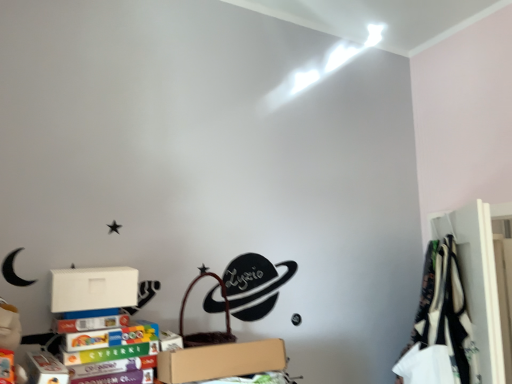
What do you see at coordinates (221, 361) in the screenshot? Image resolution: width=512 pixels, height=384 pixels. I see `brown cardboard box at lower center` at bounding box center [221, 361].

The image size is (512, 384). Describe the element at coordinates (481, 270) in the screenshot. I see `white fabric at right` at that location.

You are a GUI agent. You are given a task and a screenshot of the screen. Output one action in this format:
    pyautogui.click(x=<x>, y=<y>)
    Task: Click on the brown cardboard box at lower center
    This screenshot has width=512, height=384.
    Given the screenshot: What is the action you would take?
    pyautogui.click(x=221, y=361)

This screenshot has height=384, width=512. What are the coordinates of `cardboard box that is on the left side of white fabric at right` in the screenshot? It's located at (93, 288).

Is white fabric at right placed right next to white matte cardboard box at lower left?

No, white fabric at right is not making contact with white matte cardboard box at lower left.

From the image's perspective, would you say white fabric at right is positioned over white matte cardboard box at lower left?

No, from the image's perspective, white fabric at right is not above white matte cardboard box at lower left.

From a real-world perspective, who is located higher, white fabric at right or white matte cardboard box at lower left?

white matte cardboard box at lower left is physically above.

Which object is further away from the camera taking this photo, brown cardboard box at lower center or white matte cardboard box at lower left?

white matte cardboard box at lower left is further from the camera.

From a real-world perspective, who is located higher, brown cardboard box at lower center or white matte cardboard box at lower left?

white matte cardboard box at lower left, from a real-world perspective.

Find the location of a particular element. cardboard box located above the brown cardboard box at lower center (from the image's perspective) is located at coordinates (93, 288).

Can you confirm if white fabric at right is shorter than brown cardboard box at lower center?

No, white fabric at right is not shorter than brown cardboard box at lower center.

Consider the image. Can you confirm if white fabric at right is thinner than brown cardboard box at lower center?

Yes.

Which object is positioned more to the right, white fabric at right or brown cardboard box at lower center?

white fabric at right is more to the right.

From the image's perspective, between white fabric at right and brown cardboard box at lower center, who is located below?

brown cardboard box at lower center.

From a real-world perspective, is white matte cardboard box at lower left physically located above or below brown cardboard box at lower center?

white matte cardboard box at lower left is above brown cardboard box at lower center.

Which of these two, white matte cardboard box at lower left or brown cardboard box at lower center, is smaller?

white matte cardboard box at lower left.

From the picture: Is white matte cardboard box at lower left with brown cardboard box at lower center?

No, white matte cardboard box at lower left is not next to brown cardboard box at lower center.

In the scene shown: Is the depth of white matte cardboard box at lower left less than that of brown cardboard box at lower center?

No, it is not.

Is brown cardboard box at lower center inside or outside of white fabric at right?

The correct answer is: outside.

In the scene shown: Considering the positions of objects brown cardboard box at lower center and white fabric at right in the image provided, who is behind, brown cardboard box at lower center or white fabric at right?

Positioned behind is white fabric at right.

Between brown cardboard box at lower center and white fabric at right, which one has larger size?

white fabric at right.

Between point (225, 352) and point (487, 331), which one is positioned behind?

Positioned behind is point (487, 331).

Based on their sizes in the image, would you say white matte cardboard box at lower left is bigger or smaller than white fabric at right?

white matte cardboard box at lower left is smaller than white fabric at right.

The image size is (512, 384). Find the location of `closet on the right of white matte cardboard box at lower left`. closet on the right of white matte cardboard box at lower left is located at coordinates (481, 270).

Measure the distance from white matte cardboard box at lower left to white fabric at right.

They are 4.24 feet apart.

At what (x,y) coordinates should I click in order to perform the action: click on closet below the white matte cardboard box at lower left (from the image's perspective). Please return your answer as a coordinate pair (x, y). This screenshot has height=384, width=512. Looking at the image, I should click on (481, 270).

At what (x,y) coordinates should I click in order to perform the action: click on cardboard box behind the brown cardboard box at lower center. Please return your answer as a coordinate pair (x, y). The width and height of the screenshot is (512, 384). Looking at the image, I should click on (93, 288).

From the image, which object appears to be nearer to brown cardboard box at lower center, white matte cardboard box at lower left or white fabric at right?

white matte cardboard box at lower left.

Looking at the image, which one is located closer to white matte cardboard box at lower left, white fabric at right or brown cardboard box at lower center?

brown cardboard box at lower center is closer to white matte cardboard box at lower left.

In the scene shown: From the image, which object appears to be nearer to white matte cardboard box at lower left, brown cardboard box at lower center or white fabric at right?

The object closer to white matte cardboard box at lower left is brown cardboard box at lower center.

From the image, which object appears to be farther from white fabric at right, white matte cardboard box at lower left or brown cardboard box at lower center?

Among the two, white matte cardboard box at lower left is located further to white fabric at right.

Considering their positions, is white fabric at right positioned further to brown cardboard box at lower center than white matte cardboard box at lower left?

Based on the image, white fabric at right appears to be further to brown cardboard box at lower center.

Considering their positions, is brown cardboard box at lower center positioned further to white fabric at right than white matte cardboard box at lower left?

Among the two, white matte cardboard box at lower left is located further to white fabric at right.

The image size is (512, 384). Find the location of `box between white matte cardboard box at lower left and white fabric at right in the horizontal direction`. box between white matte cardboard box at lower left and white fabric at right in the horizontal direction is located at coordinates (221, 361).